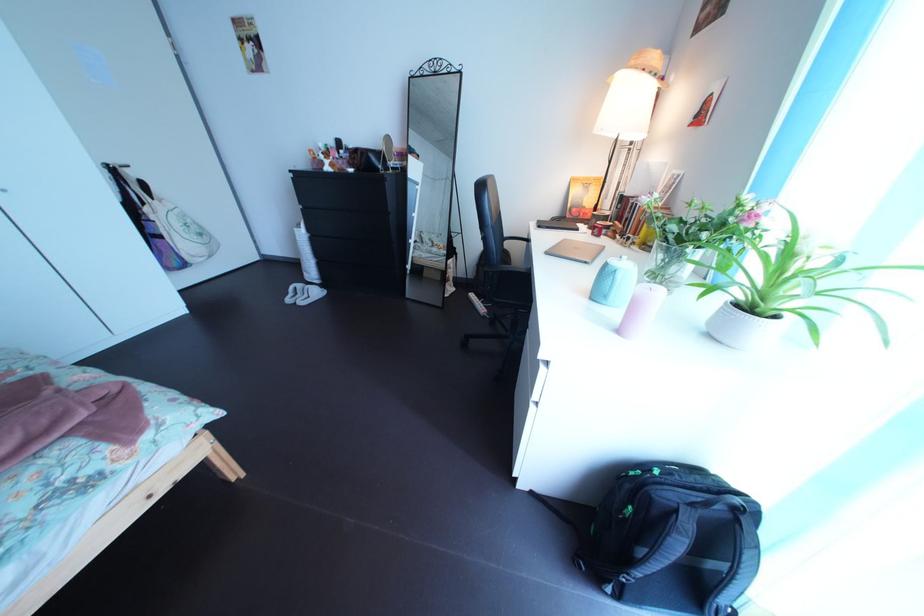
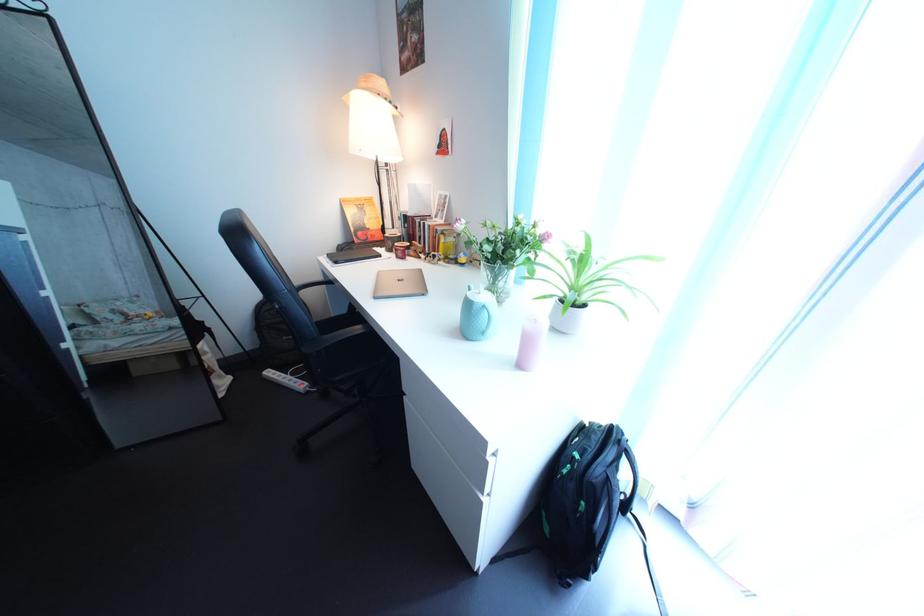
Locate, in the second image, the point that corresponds to pixel 487 304 in the first image.

(284, 381)